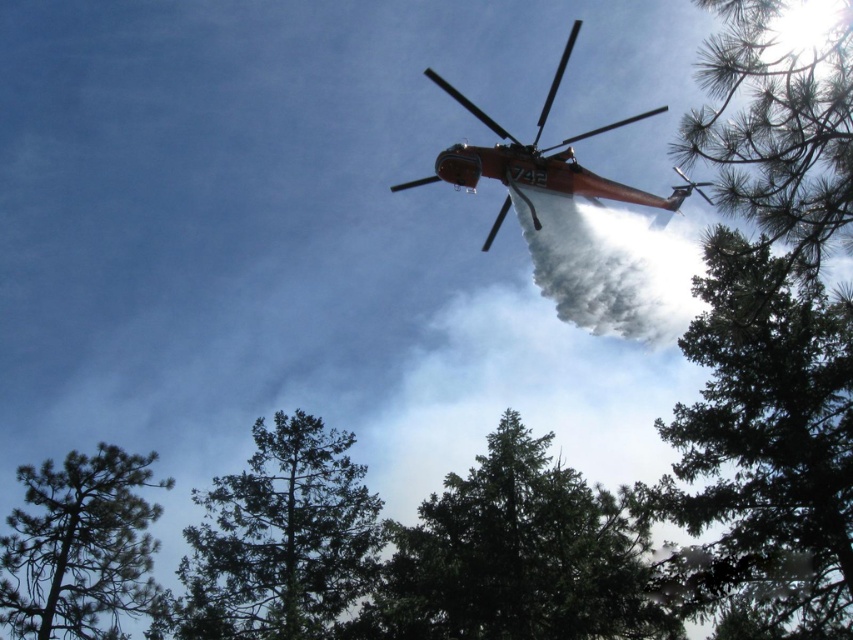
You are a pilot flying a helicopter and need to drop a package near the green textured tree at center. According to the coordinates provided, where should you aim your drop zone?

The green textured tree at center is located at coordinates point (x=280, y=538), so you should aim your drop zone at those coordinates.

You are a pilot flying a helicopter and need to drop water on the dark green textured tree at center and the green matte tree at lower left. Which tree should you target first if you want to hit the wider one?

The dark green textured tree at center might be wider than green matte tree at lower left, so you should target the dark green textured tree at center first.

You are a pilot flying a metallic orange helicopter at upper center. You need to drop water onto the dark green textured tree at center. Based on the scene, can you confirm if the helicopter is positioned above the tree to make an effective drop?

The dark green textured tree at center is located below the metallic orange helicopter at upper center, so yes, the helicopter is positioned above the tree to make an effective drop.